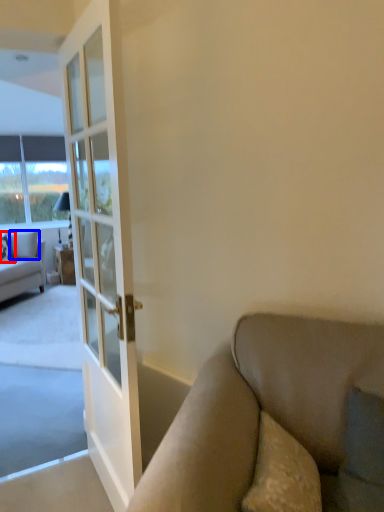
Question: Which point is closer to the camera, pillow (highlighted by a red box) or pillow (highlighted by a blue box)?

Choices:
 (A) pillow
 (B) pillow

Answer: (A)